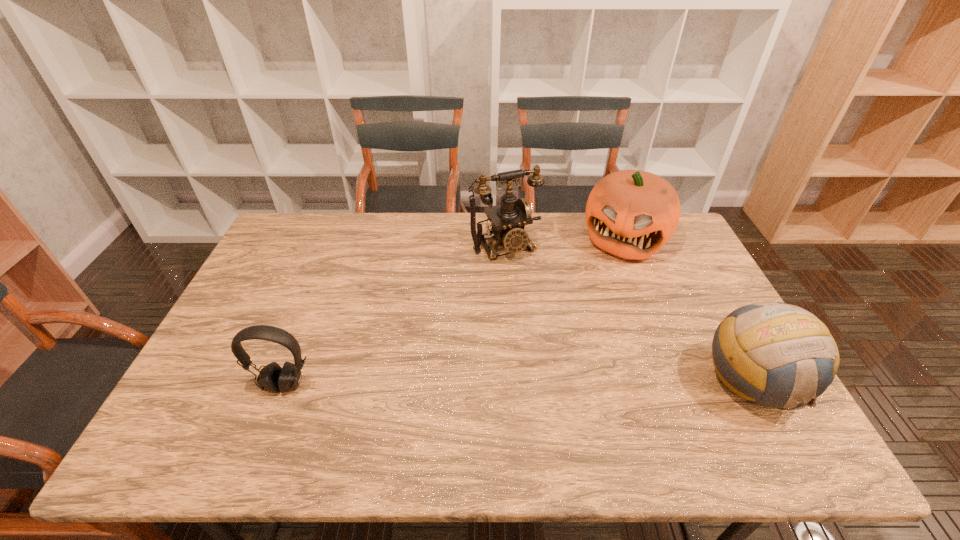
The height and width of the screenshot is (540, 960). I want to click on free space on the desktop that is between the leftmost object and the volleyball and is positioned on the rotary dial of the telephone, so (x=588, y=383).

Image resolution: width=960 pixels, height=540 pixels. In order to click on free space on the desktop that is between the leftmost object and the volleyball and is positioned on the face of the pumpkin in this screenshot , I will do `click(561, 383)`.